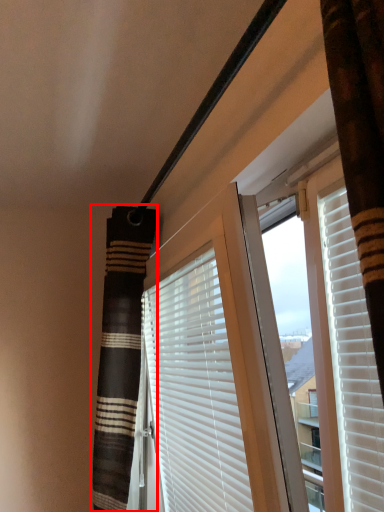
Question: Observing the image, what is the correct spatial positioning of shower curtain (annotated by the red box) in reference to window blind?

Choices:
 (A) left
 (B) right

Answer: (A)